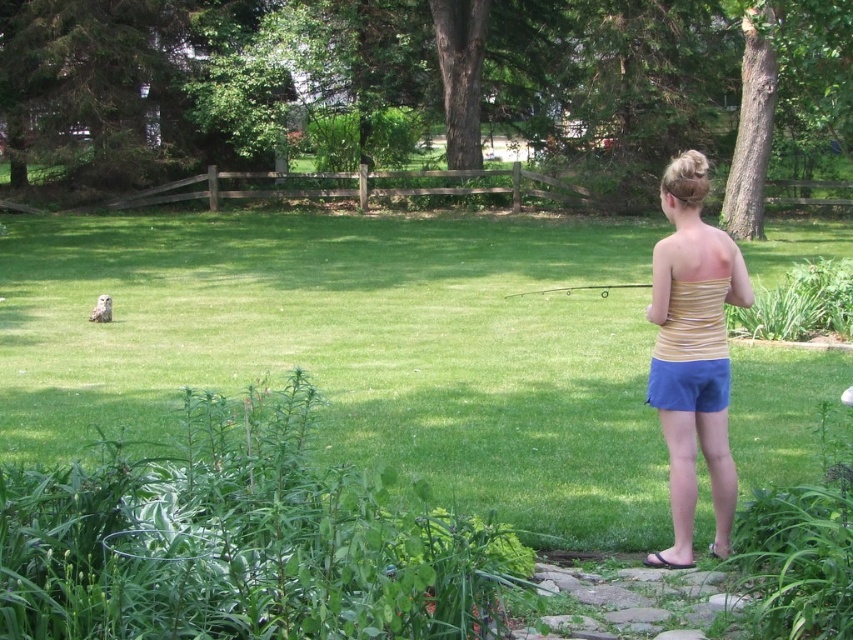
You are a gardener standing in the backyard. You see the green grass at center and the yellow striped tank top at center. Which object is closer to you?

The yellow striped tank top at center is closer to you because it is positioned above the green grass at center.

You are a gardener who needs to mow the lawn. You see the green grass at center and the yellow striped tank top at center. Which object is bigger and should be prioritized for mowing?

The green grass at center has a larger size compared to the yellow striped tank top at center, so it should be prioritized for mowing.

You are standing at the starting point of the stone pathway in the foreground. You want to walk straight ahead towards the wooden fence in the background. Will the green grass at center be in your path?

The green grass at center is located at point (358,348), which lies along the path from the stone pathway to the wooden fence. Therefore, the green grass at center will be in your path.